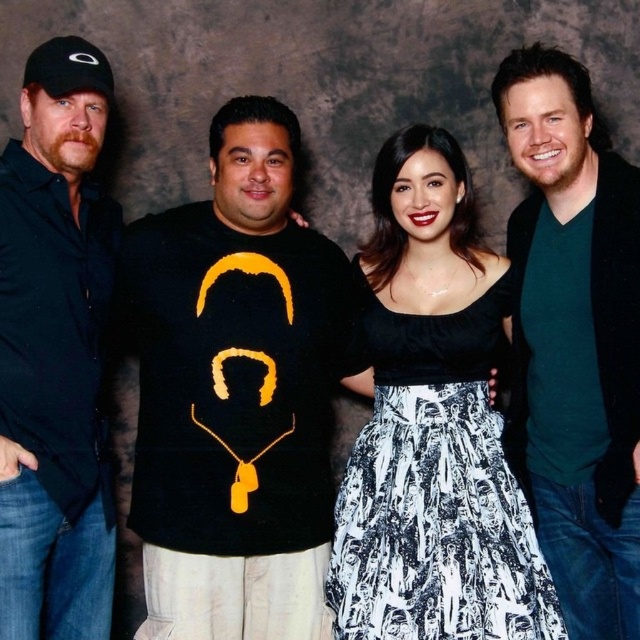
Question: Which point is closer to the camera?

Choices:
 (A) black matte shirt at left
 (B) green matte shirt at right

Answer: (A)

Question: Which of the following is the farthest from the observer?

Choices:
 (A) (289, 266)
 (B) (96, 228)
 (C) (531, 477)

Answer: (B)

Question: Considering the real-world distances, which object is farthest from the black matte t-shirt at left?

Choices:
 (A) black satin dress at center
 (B) green matte shirt at right
 (C) black matte t-shirt at center
 (D) black matte shirt at left

Answer: (B)

Question: Considering the relative positions of black satin dress at center and green matte shirt at right in the image provided, where is black satin dress at center located with respect to green matte shirt at right?

Choices:
 (A) above
 (B) below

Answer: (B)

Question: Is black satin dress at center thinner than black matte t-shirt at left?

Choices:
 (A) no
 (B) yes

Answer: (A)

Question: Does black satin dress at center appear over black matte t-shirt at left?

Choices:
 (A) no
 (B) yes

Answer: (A)